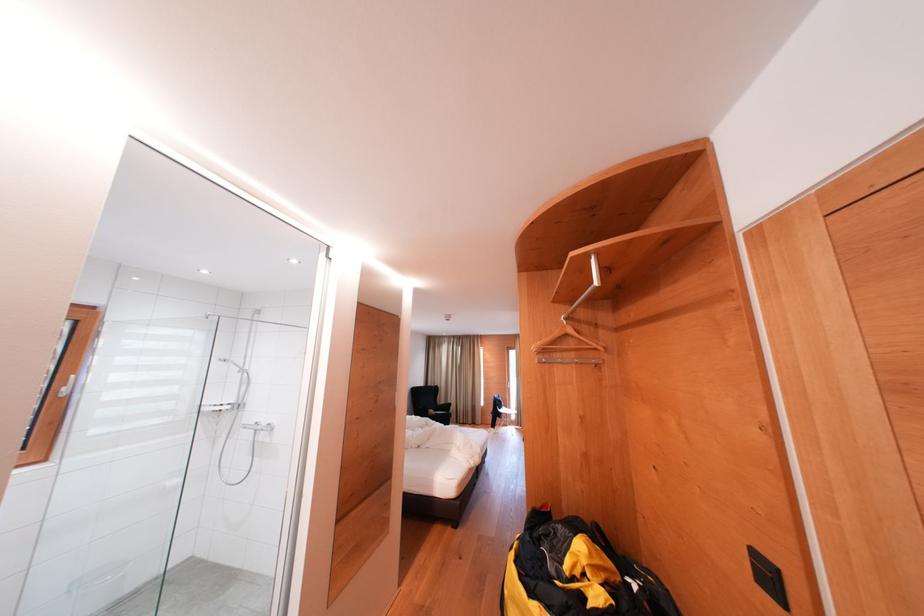
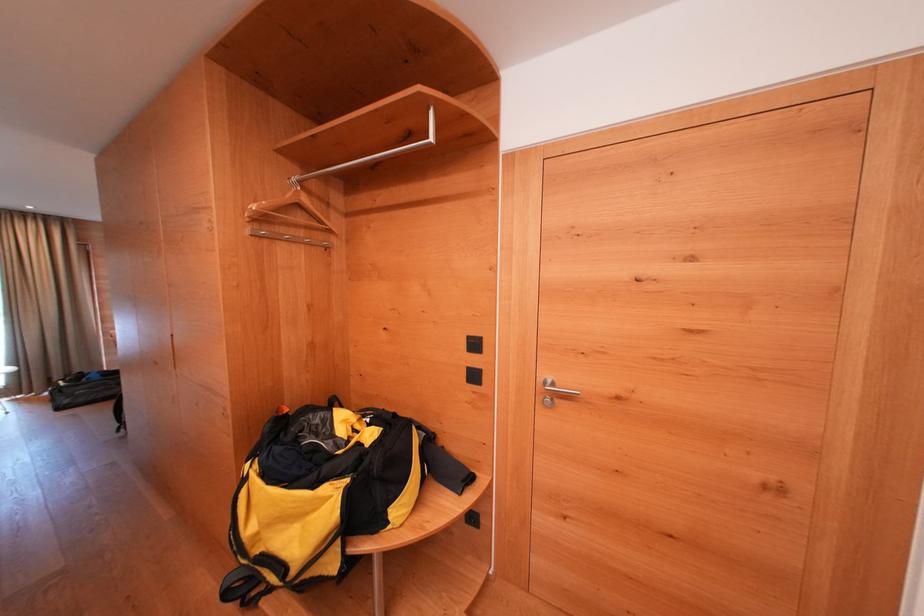
Question: The camera is either moving clockwise (left) or counter-clockwise (right) around the object. The first image is from the beginning of the video and the second image is from the end. Is the camera moving left or right when shooting the video?

Choices:
 (A) Left
 (B) Right

Answer: (A)